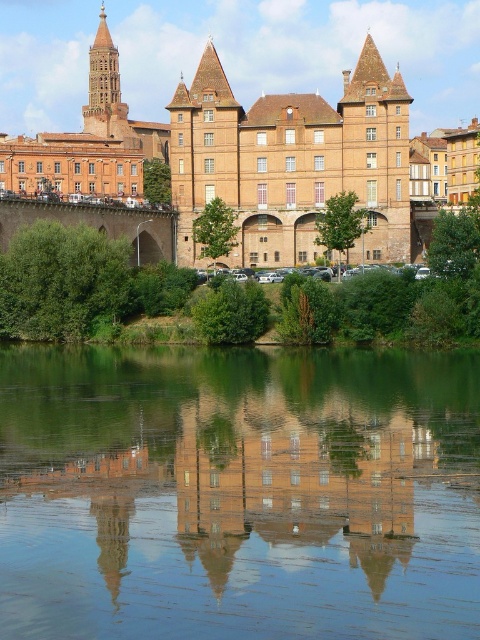
You are standing on a path near the riverside and want to take a photo of the matte brick building at center and its reflection in the green reflective water at center. Based on their positions, where should you position yourself to capture both the building and its reflection in the same frame?

You should position yourself at a lower elevation or closer to the green reflective water at center since it is below the matte brick building at center, allowing you to frame both the building and its reflection in the water.

You are an architect analyzing the symmetry of the riverside scene. You notice the green reflective water at center and the brown brick building at center. Which object appears narrower when viewed from your perspective?

The green reflective water at center appears narrower than the brown brick building at center.